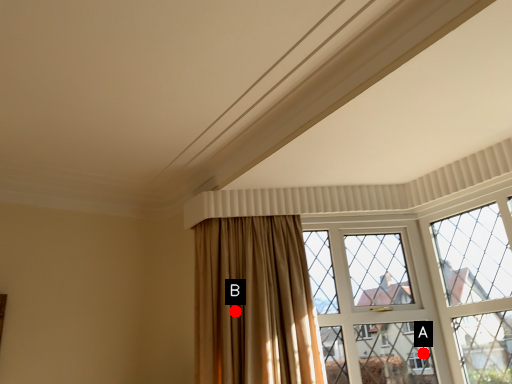
Question: Two points are circled on the image, labeled by A and B beside each circle. Among these points, which one is farthest from the camera?

Choices:
 (A) A is further
 (B) B is further

Answer: (A)